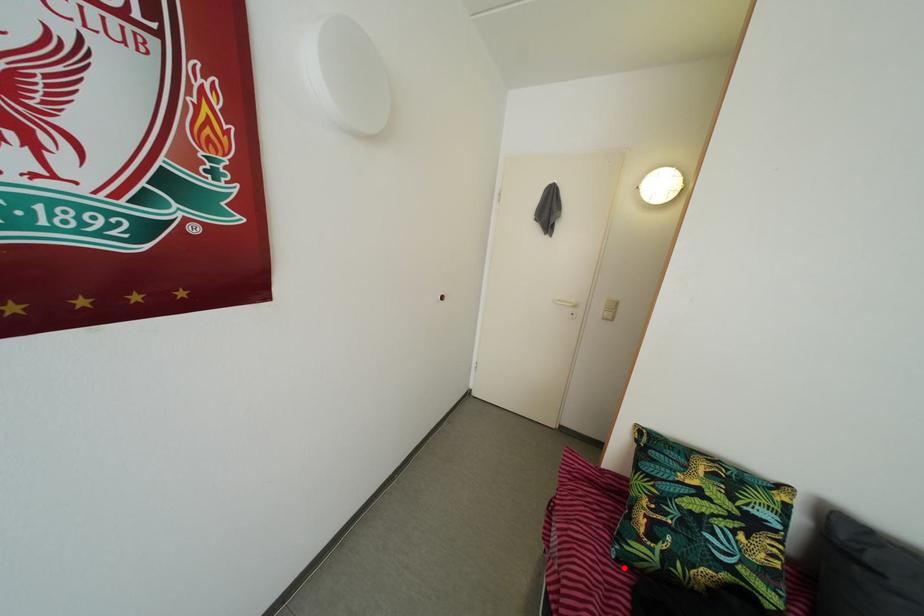
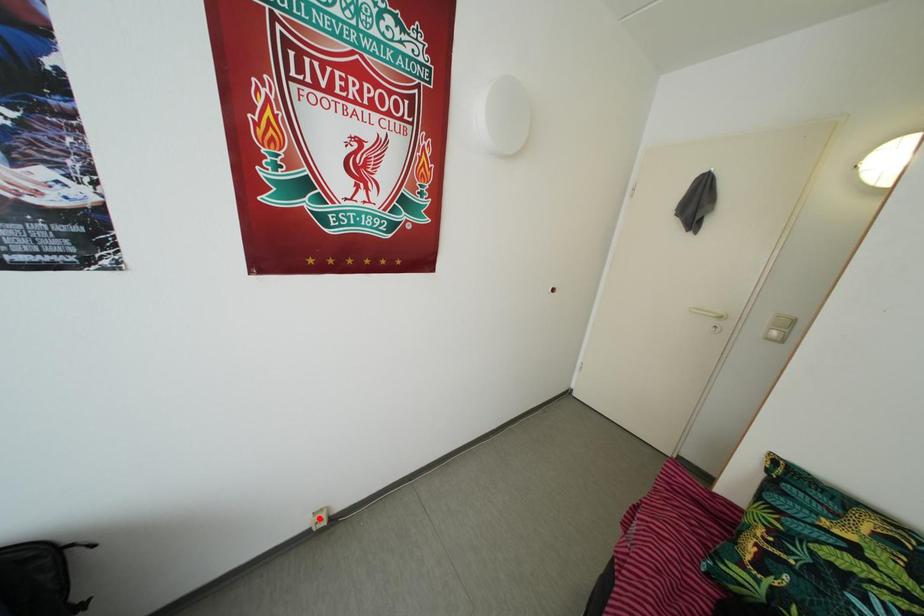
I am providing you with two images of the same scene from different viewpoints. A red point is marked on the first image and another point is marked on the second image. Is the red point in image1 aligned with the point shown in image2?

No